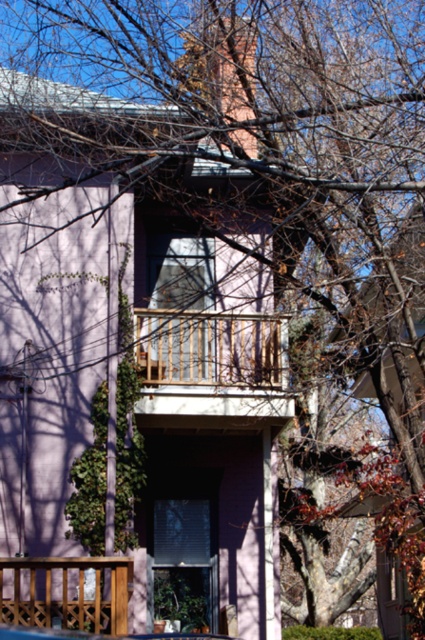
Question: Which object is closer to the camera taking this photo?

Choices:
 (A) wooden at lower left
 (B) wooden at center

Answer: (A)

Question: Does wooden at center have a smaller size compared to wooden at lower left?

Choices:
 (A) no
 (B) yes

Answer: (B)

Question: Which point is farther to the camera?

Choices:
 (A) (96, 592)
 (B) (269, 348)

Answer: (B)

Question: Does wooden at center come in front of wooden at lower left?

Choices:
 (A) yes
 (B) no

Answer: (B)

Question: Which of the following is the farthest from the observer?

Choices:
 (A) (209, 324)
 (B) (119, 634)

Answer: (A)

Question: Is wooden at center bigger than wooden at lower left?

Choices:
 (A) yes
 (B) no

Answer: (B)